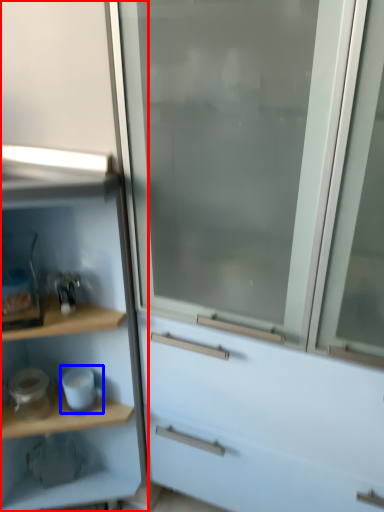
Question: Which point is further to the camera, cupboard (highlighted by a red box) or appliance (highlighted by a blue box)?

Choices:
 (A) cupboard
 (B) appliance

Answer: (B)